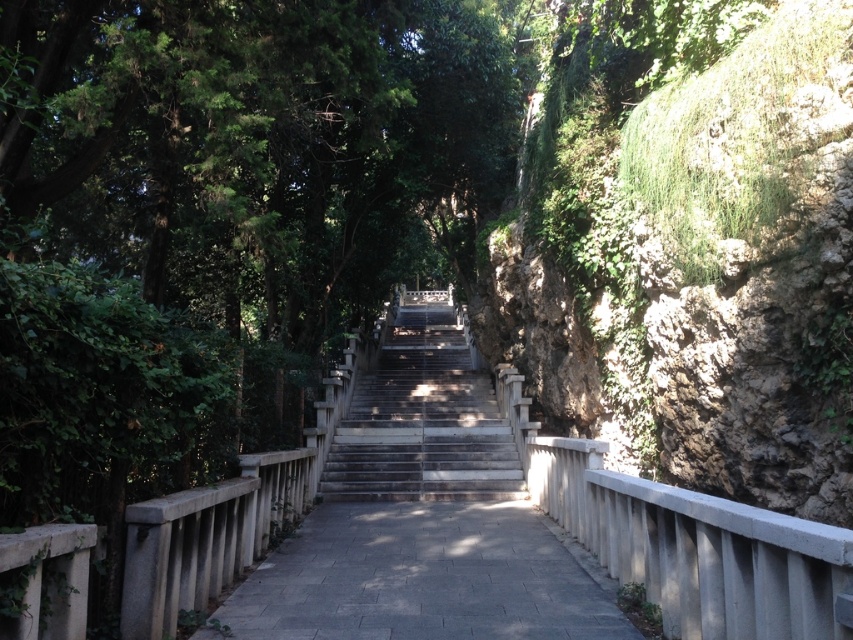
You are standing at the bottom of the staircase and want to walk up the gray concrete path at center. Is the green leafy tree at center blocking your path?

The green leafy tree at center is positioned over the gray concrete path at center, so it might block your path depending on the tree branches and canopy. However, the description does not specify if the tree is blocking the path physically, so we cannot confirm for sure.